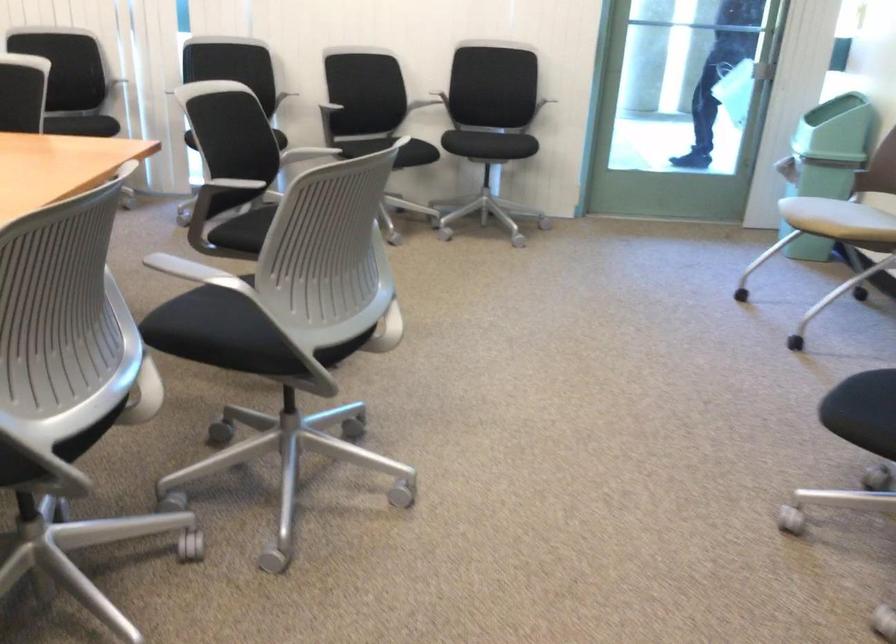
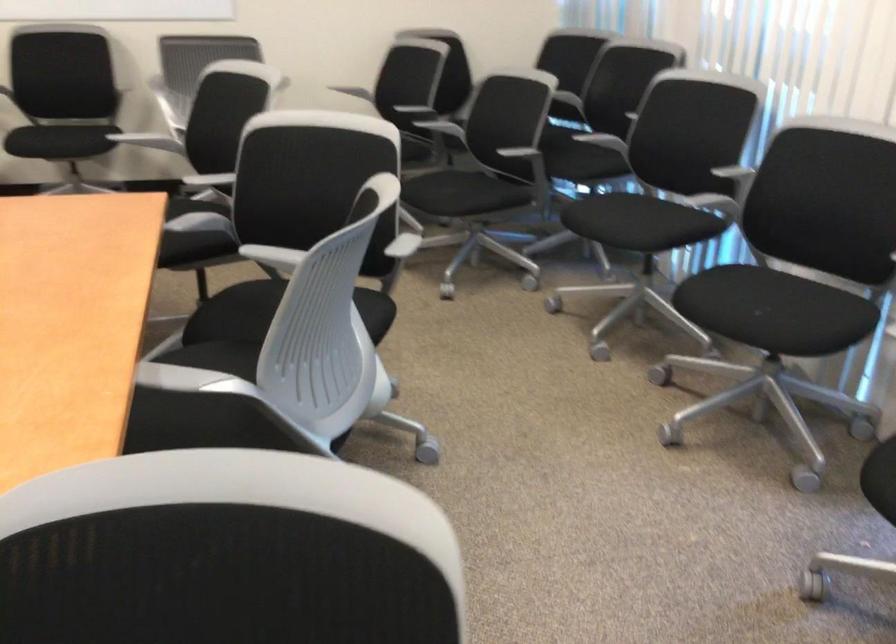
In the second image, find the point that corresponds to point 177,192 in the first image.

(858, 527)